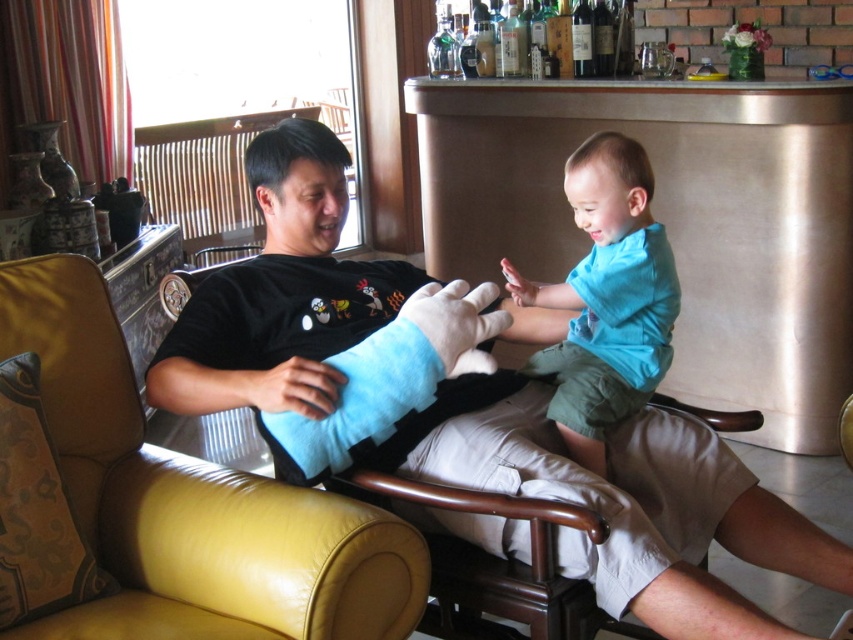
You are standing in the room and want to place a small table next to the yellow leather armchair at left. According to the coordinates provided, where should you position the table to be adjacent to the armchair?

The yellow leather armchair at left is located at point (190, 502), so you should position the table near those coordinates to place it next to the armchair.

You are a furniture delivery person who just arrived at a house. You have to place the blue soft plush at center on top of the yellow leather armchair at left. Can you do that without needing to adjust the size of either object?

The yellow leather armchair at left is bigger than blue soft plush at center, so yes, the blue soft plush at center can be placed on top of the yellow leather armchair at left without needing to adjust their sizes since the chair is larger.